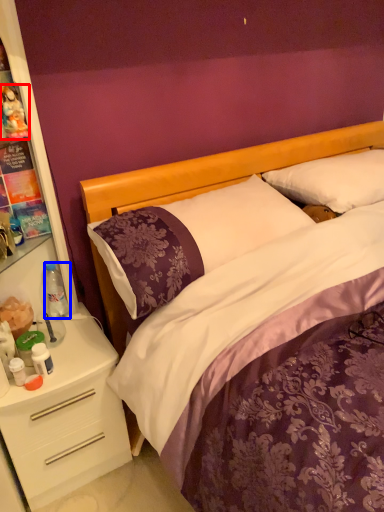
Question: Which object appears farthest to the camera in this image, toy (highlighted by a red box) or bottle (highlighted by a blue box)?

Choices:
 (A) toy
 (B) bottle

Answer: (B)